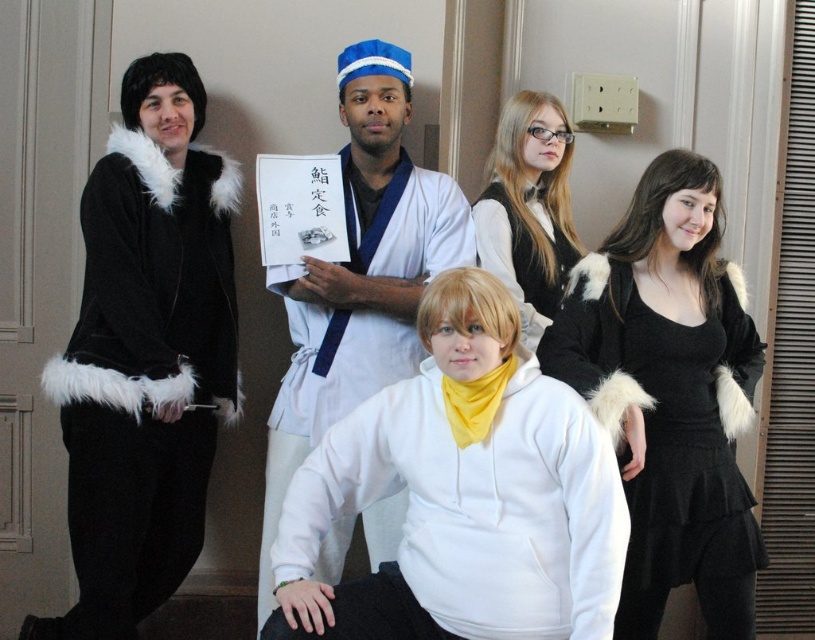
Question: Which object is closer to the camera taking this photo?

Choices:
 (A) white cotton kimono at center
 (B) black fur-trimmed dress at right

Answer: (B)

Question: Which point is closer to the camera taking this photo?

Choices:
 (A) (322, 317)
 (B) (106, 460)
 (C) (751, 394)
 (D) (482, 257)

Answer: (B)

Question: Can you confirm if black velvet fur-trimmed robe at left is positioned above smooth black dress at upper right?

Choices:
 (A) no
 (B) yes

Answer: (A)

Question: Can you confirm if white cotton kimono at center is positioned to the right of smooth black dress at upper right?

Choices:
 (A) no
 (B) yes

Answer: (A)

Question: Observing the image, what is the correct spatial positioning of black fur-trimmed dress at right in reference to smooth black dress at upper right?

Choices:
 (A) below
 (B) above

Answer: (A)

Question: Which object is closer to the camera taking this photo?

Choices:
 (A) black velvet fur-trimmed robe at left
 (B) white fleece hoodie at center
 (C) white cotton kimono at center
 (D) black fur-trimmed dress at right

Answer: (B)